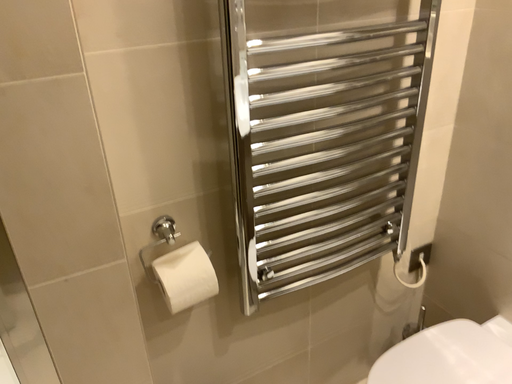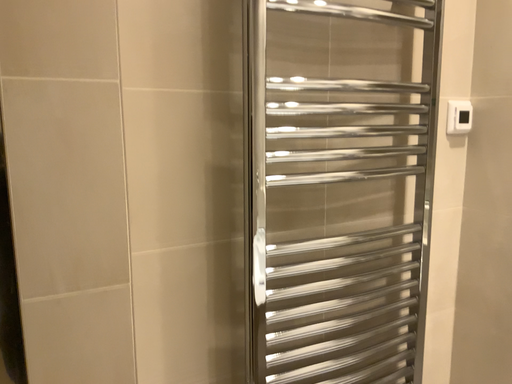
Question: Which way did the camera rotate in the video?

Choices:
 (A) rotated upward
 (B) rotated downward

Answer: (A)